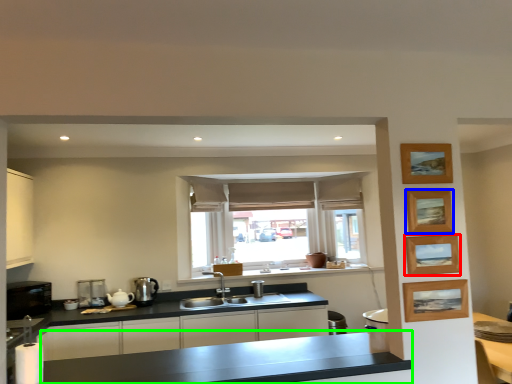
Question: Which object is the farthest from picture frame (highlighted by a red box)? Choose among these: picture frame (highlighted by a blue box) or countertop (highlighted by a green box).

Choices:
 (A) picture frame
 (B) countertop

Answer: (B)